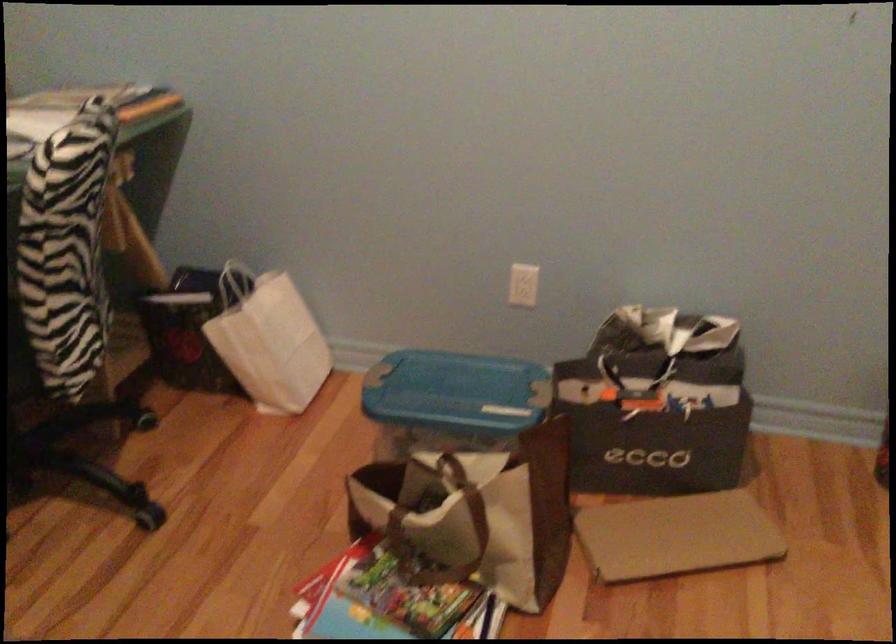
Identify the location of blue container lid. This screenshot has width=896, height=644. (455, 393).